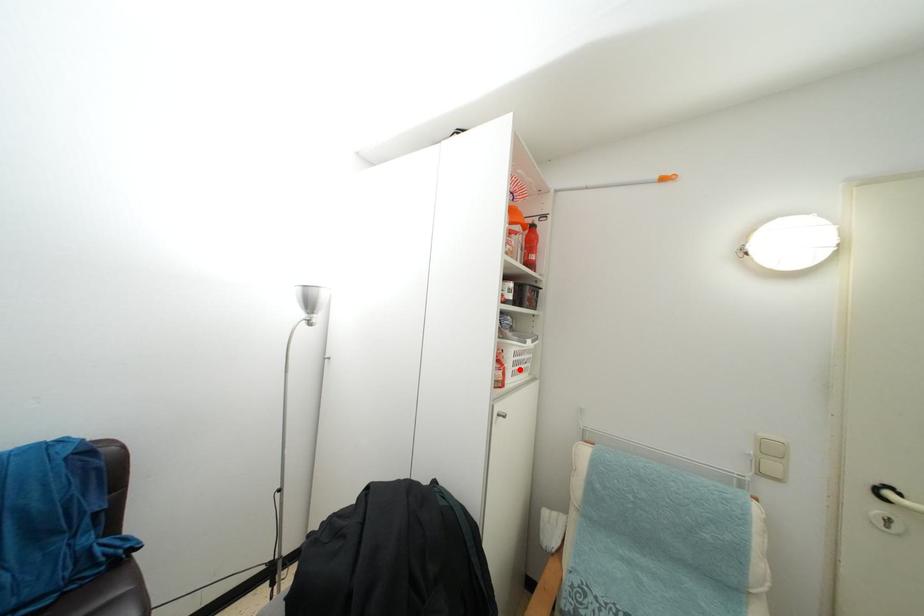
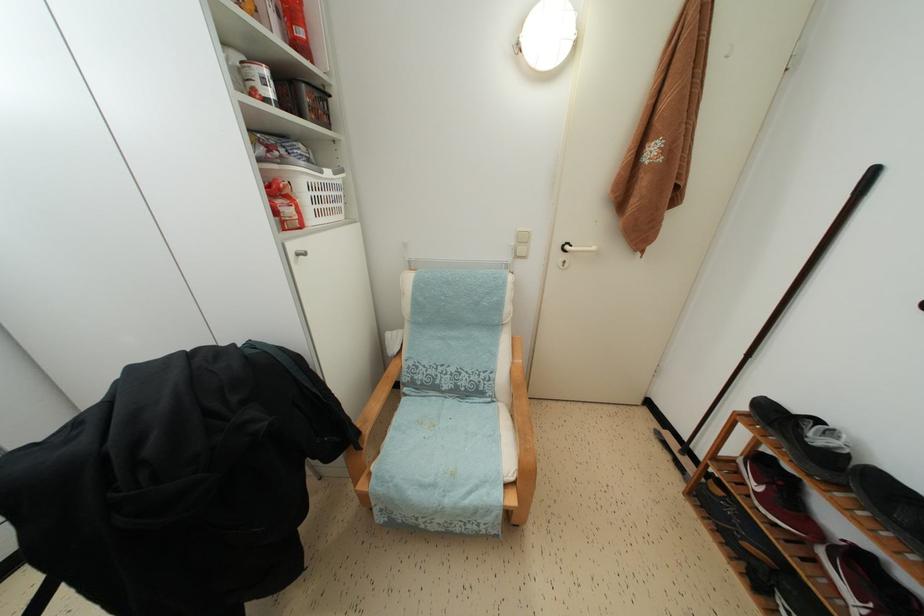
In the second image, find the point that corresponds to the highlighted location in the first image.

(319, 206)